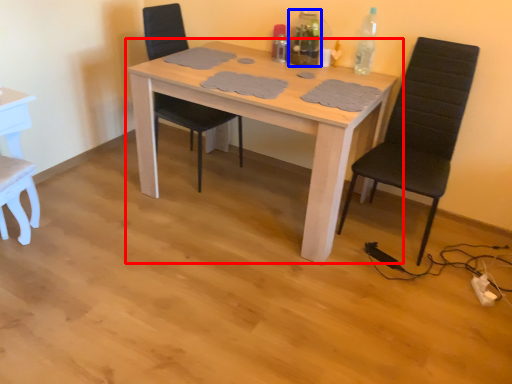
Question: Which point is closer to the camera, table (highlighted by a red box) or bottle (highlighted by a blue box)?

Choices:
 (A) table
 (B) bottle

Answer: (A)